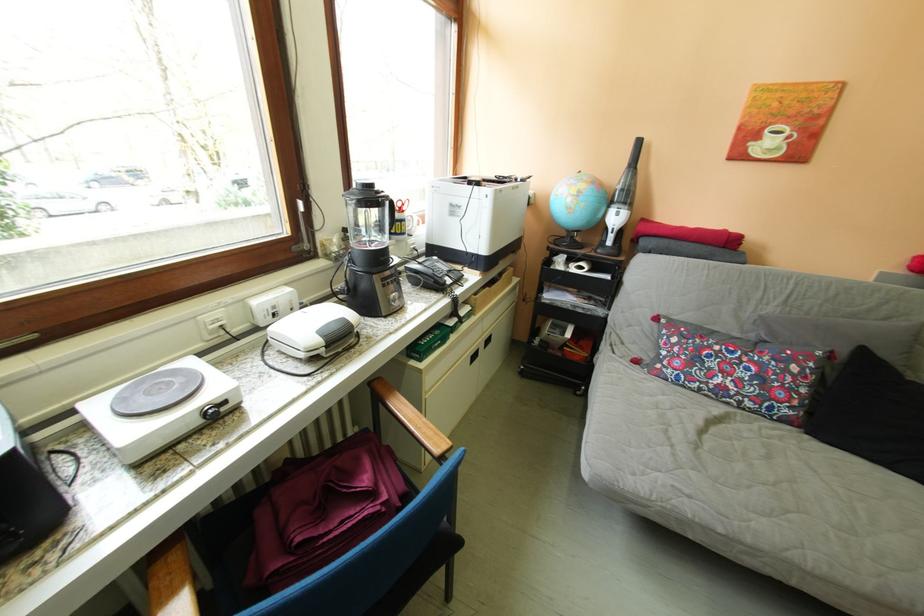
Identify the location of telephone handset. This screenshot has width=924, height=616. (442, 270).